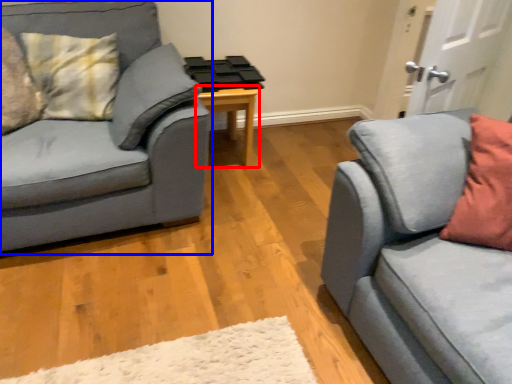
Question: Which object appears closest to the camera in this image, table (highlighted by a red box) or studio couch (highlighted by a blue box)?

Choices:
 (A) table
 (B) studio couch

Answer: (B)